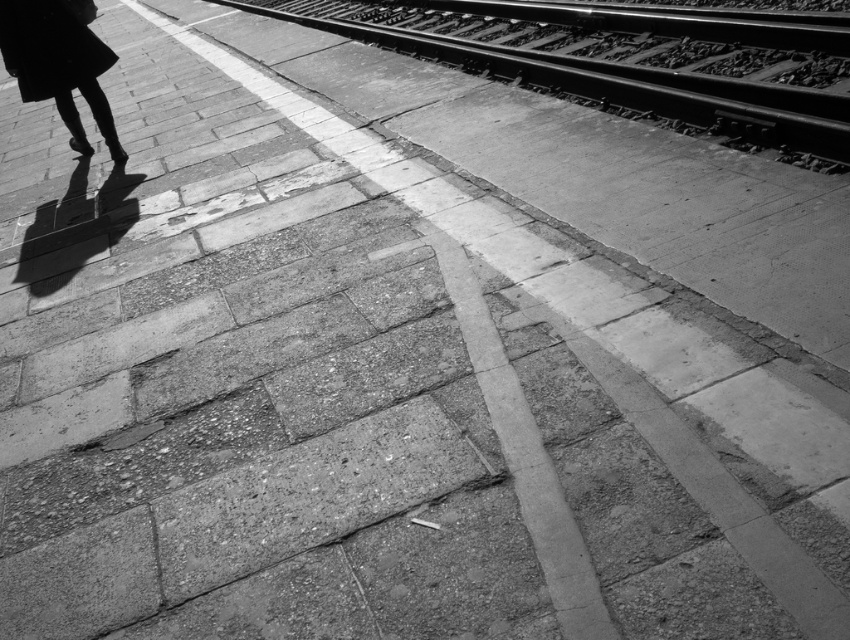
You are standing on the railway platform in the image. You need to place a safety cone exactly at the position of the smooth metal train track at upper right. What are the coordinates where you should place the safety cone?

The smooth metal train track at upper right is located at point (608,67), so you should place the safety cone at those coordinates.

You are standing at the point marked as point (608, 67) on the railway platform. Looking towards the upper right, you see the smooth metal train track at upper right. What is the nearest object to you on the platform besides the train track?

The nearest object to you at point (608, 67) would be the large rectangular paving stones that make up the platform, as they form the surface you are standing on.

You are standing on the railway platform and want to reach the point marked at coordinates point (840, 161). If you walk straight ahead, will you reach that point within 4 meters?

Yes, the point (840, 161) is 3.84 meters from the viewer, so walking straight ahead will reach it within 4 meters.